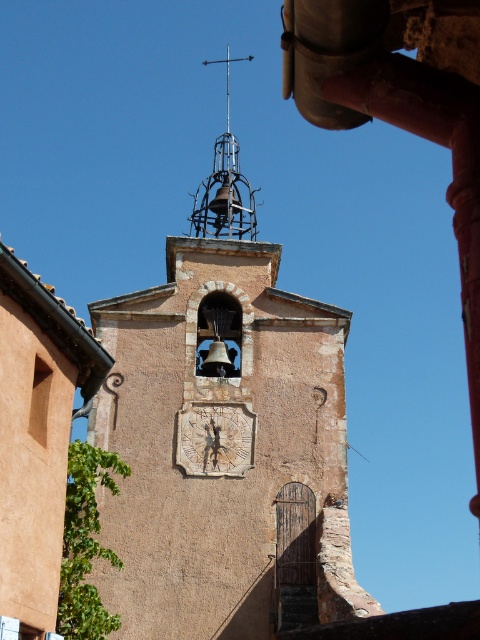
Question: Which of these objects is positioned farthest from the brown textured stone clock tower at center?

Choices:
 (A) white textured clock at center
 (B) metallic bell tower at upper center

Answer: (B)

Question: Where is brown textured stone clock tower at center located in relation to metallic bell tower at upper center in the image?

Choices:
 (A) right
 (B) left

Answer: (A)

Question: Does brown textured stone clock tower at center have a greater width compared to metallic bell tower at upper center?

Choices:
 (A) yes
 (B) no

Answer: (A)

Question: Based on their relative distances, which object is nearer to the metallic bell tower at upper center?

Choices:
 (A) brown textured stone clock tower at center
 (B) white textured clock at center

Answer: (A)

Question: Which point is farther from the camera taking this photo?

Choices:
 (A) (118, 420)
 (B) (228, 144)
 (C) (240, 435)

Answer: (B)

Question: Is white textured clock at center smaller than metallic bell tower at upper center?

Choices:
 (A) yes
 (B) no

Answer: (A)